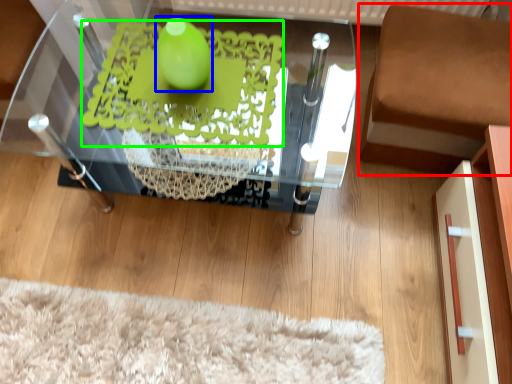
Question: Based on their relative distances, which object is nearer to furniture (highlighted by a red box)? Choose from lime (highlighted by a blue box) and design (highlighted by a green box).

Choices:
 (A) lime
 (B) design

Answer: (B)